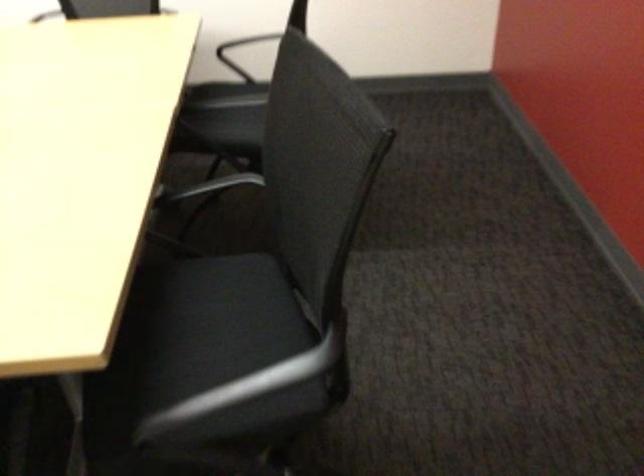
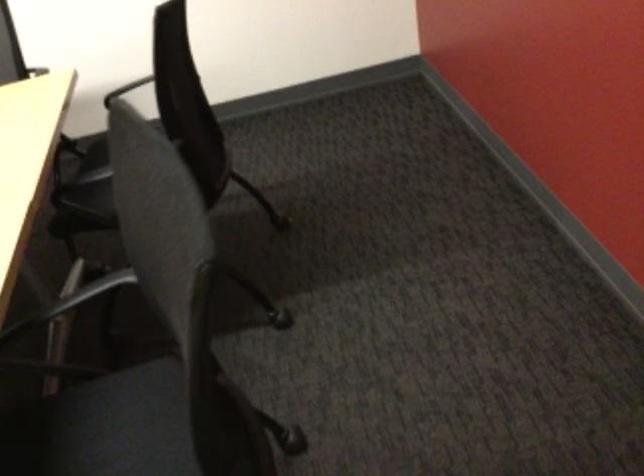
Question: The images are taken continuously from a first-person perspective. In which direction is your viewpoint rotating?

Choices:
 (A) Left
 (B) Right
 (C) Up
 (D) Down

Answer: (B)